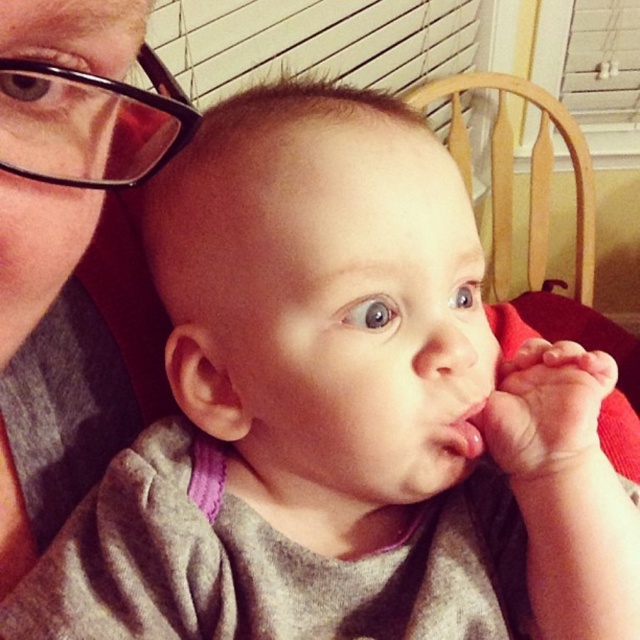
Is matte gray shirt at upper left to the left of pink matte flesh at center from the viewer's perspective?

Correct, you'll find matte gray shirt at upper left to the left of pink matte flesh at center.

Can you confirm if matte gray shirt at upper left is taller than pink matte flesh at center?

Yes, matte gray shirt at upper left is taller than pink matte flesh at center.

Does point (17, 291) come closer to viewer compared to point (461, 452)?

Yes, it is in front of point (461, 452).

You are a GUI agent. You are given a task and a screenshot of the screen. Output one action in this format:
    pyautogui.click(x=<x>, y=<y>)
    Task: Click on the matte gray shirt at upper left
    
    Given the screenshot: What is the action you would take?
    pyautogui.click(x=74, y=256)

Between point (120, 84) and point (448, 436), which one is positioned behind?

Point (448, 436)

Can you confirm if black plastic glasses at upper left is shorter than pink matte flesh at center?

In fact, black plastic glasses at upper left may be taller than pink matte flesh at center.

Is point (6, 74) positioned in front of point (460, 444)?

Yes, it is.

At what (x,y) coordinates should I click in order to perform the action: click on black plastic glasses at upper left. Please return your answer as a coordinate pair (x, y). Image resolution: width=640 pixels, height=640 pixels. Looking at the image, I should click on (90, 124).

Is wooden chair at center smaller than pink matte flesh at center?

Actually, wooden chair at center might be larger than pink matte flesh at center.

Which is above, wooden chair at center or pink matte flesh at center?

wooden chair at center is above.

Between point (497, 104) and point (464, 412), which one is positioned in front?

Positioned in front is point (464, 412).

Image resolution: width=640 pixels, height=640 pixels. I want to click on wooden chair at center, so click(x=513, y=176).